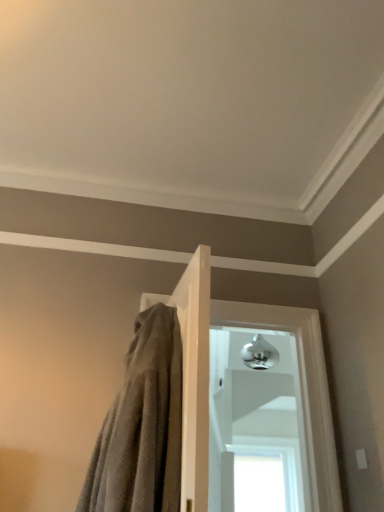
Question: From the image's perspective, is polished chrome door handle at center, the 2th window ordered from the bottom, above transparent glass window at center, positioned as the 2th window in top-to-bottom order?

Choices:
 (A) no
 (B) yes

Answer: (B)

Question: Is polished chrome door handle at center, arranged as the first window when viewed from the top, thinner than transparent glass window at center, arranged as the 1th window when ordered from the bottom?

Choices:
 (A) yes
 (B) no

Answer: (B)

Question: Does polished chrome door handle at center, arranged as the first window when viewed from the top, have a greater width compared to transparent glass window at center, positioned as the 2th window in top-to-bottom order?

Choices:
 (A) no
 (B) yes

Answer: (B)

Question: Considering the relative sizes of polished chrome door handle at center, the 2th window ordered from the bottom, and transparent glass window at center, arranged as the 1th window when ordered from the bottom, in the image provided, is polished chrome door handle at center, the 2th window ordered from the bottom, shorter than transparent glass window at center, arranged as the 1th window when ordered from the bottom,?

Choices:
 (A) no
 (B) yes

Answer: (A)

Question: Is polished chrome door handle at center, the 2th window ordered from the bottom, to the right of transparent glass window at center, positioned as the 2th window in top-to-bottom order, from the viewer's perspective?

Choices:
 (A) yes
 (B) no

Answer: (B)

Question: From the image's perspective, is gray textured towel at center positioned above or below polished chrome door handle at center, the 2th window ordered from the bottom?

Choices:
 (A) below
 (B) above

Answer: (B)

Question: Is point (148, 346) positioned closer to the camera than point (241, 503)?

Choices:
 (A) farther
 (B) closer

Answer: (B)

Question: Would you say gray textured towel at center is to the left or to the right of polished chrome door handle at center, the 2th window ordered from the bottom, in the picture?

Choices:
 (A) left
 (B) right

Answer: (A)

Question: From a real-world perspective, is gray textured towel at center positioned above or below polished chrome door handle at center, arranged as the first window when viewed from the top?

Choices:
 (A) above
 (B) below

Answer: (B)

Question: Would you say transparent glass window at center, arranged as the 1th window when ordered from the bottom, is to the left or to the right of polished chrome door handle at center, the 2th window ordered from the bottom, in the picture?

Choices:
 (A) left
 (B) right

Answer: (B)

Question: Looking at the image, does transparent glass window at center, arranged as the 1th window when ordered from the bottom, seem bigger or smaller compared to polished chrome door handle at center, the 2th window ordered from the bottom?

Choices:
 (A) big
 (B) small

Answer: (B)

Question: Is transparent glass window at center, arranged as the 1th window when ordered from the bottom, taller or shorter than polished chrome door handle at center, arranged as the first window when viewed from the top?

Choices:
 (A) tall
 (B) short

Answer: (B)

Question: From a real-world perspective, is transparent glass window at center, positioned as the 2th window in top-to-bottom order, physically located above or below polished chrome door handle at center, the 2th window ordered from the bottom?

Choices:
 (A) below
 (B) above

Answer: (A)

Question: Does point (248, 420) appear closer or farther from the camera than point (120, 446)?

Choices:
 (A) closer
 (B) farther

Answer: (B)

Question: Is polished chrome door handle at center, the 2th window ordered from the bottom, bigger or smaller than gray textured towel at center?

Choices:
 (A) big
 (B) small

Answer: (A)